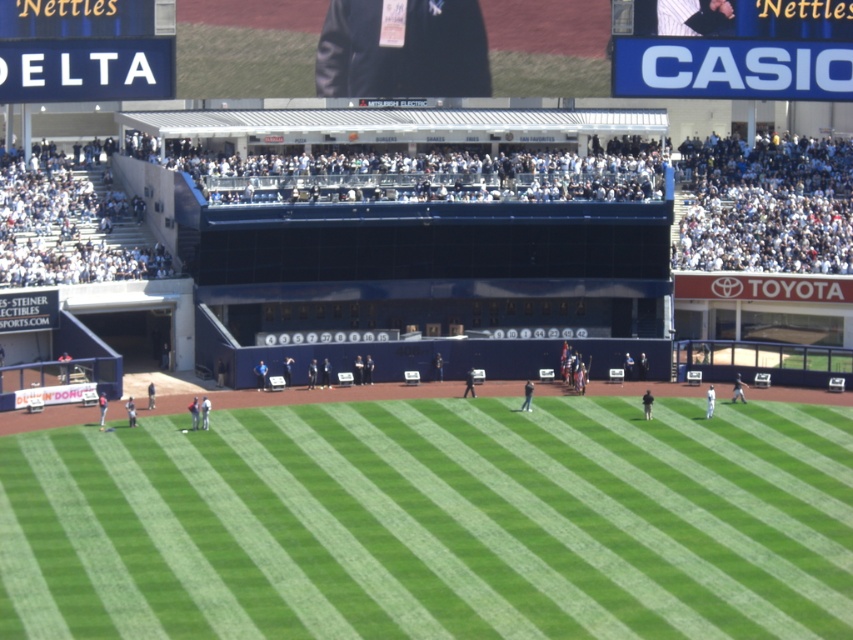
Consider the image. You are a drone operator trying to capture a closeup shot of the blue plastic sign at upper center from the green grass at center. The drone has a maximum range of 30 meters. Can the drone reach the sign from the grass without exceeding its range?

The green grass at center is 29.58 meters from the blue plastic sign at upper center. Since the drone has a maximum range of 30 meters, it can reach the sign without exceeding its range as 29.58 meters is within the 30 meters limit.

What is the object located at the coordinates point (732, 49) in the image?

The point (732, 49) marks the blue plastic sign at upper center.

In the scene shown: You are a fan sitting in the stands and want to locate the green grass at center and the blue plastic sign at upper left. From your viewpoint, which object is positioned lower?

The green grass at center is positioned lower than the blue plastic sign at upper left.